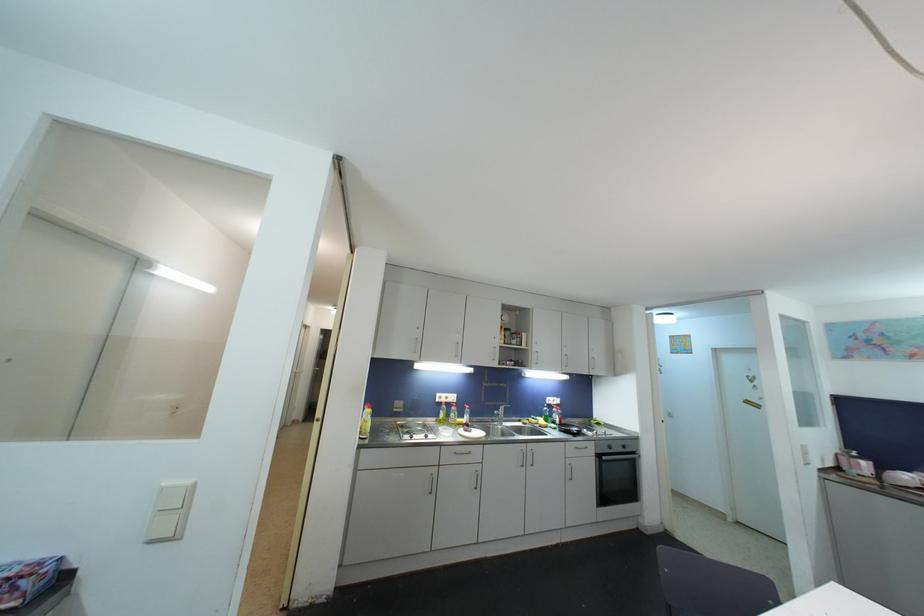
The image size is (924, 616). In order to click on faucet handle in this screenshot , I will do `click(501, 413)`.